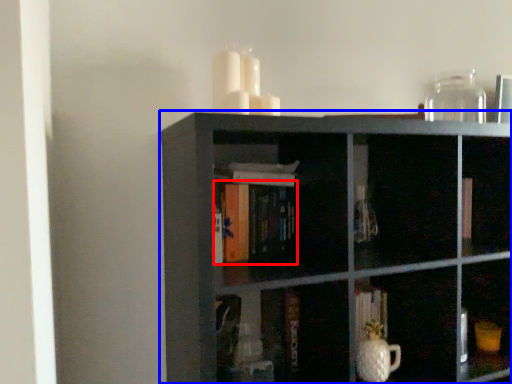
Question: Which object appears closest to the camera in this image, book (highlighted by a red box) or shelf (highlighted by a blue box)?

Choices:
 (A) book
 (B) shelf

Answer: (B)